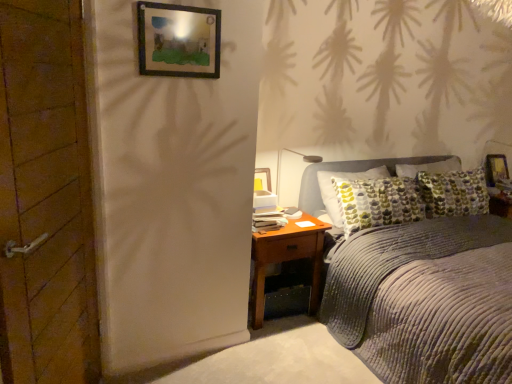
Question: Is wooden framed picture at upper center, which is counted as the second picture frame, starting from the back, bigger than wooden door at left?

Choices:
 (A) no
 (B) yes

Answer: (A)

Question: Is wooden framed picture at upper center, the 1th picture frame from the left, wider than wooden door at left?

Choices:
 (A) yes
 (B) no

Answer: (B)

Question: Can you confirm if wooden framed picture at upper center, which is the 2th picture frame in bottom-to-top order, is shorter than wooden door at left?

Choices:
 (A) no
 (B) yes

Answer: (B)

Question: Can you see wooden framed picture at upper center, the 1th picture frame from the left, touching wooden door at left?

Choices:
 (A) no
 (B) yes

Answer: (A)

Question: Is wooden framed picture at upper center, which is counted as the second picture frame, starting from the back, at the right side of wooden door at left?

Choices:
 (A) no
 (B) yes

Answer: (B)

Question: Considering the relative positions of wooden framed picture at upper center, arranged as the first picture frame when viewed from the top, and wooden door at left in the image provided, is wooden framed picture at upper center, arranged as the first picture frame when viewed from the top, in front of wooden door at left?

Choices:
 (A) no
 (B) yes

Answer: (A)

Question: Is the surface of wooden framed picture at upper center, which is the 2th picture frame in bottom-to-top order, in direct contact with brown wooden nightstand at lower right?

Choices:
 (A) no
 (B) yes

Answer: (A)

Question: Is wooden framed picture at upper center, the 1th picture frame from the left, facing away from brown wooden nightstand at lower right?

Choices:
 (A) no
 (B) yes

Answer: (A)

Question: Could you tell me if wooden framed picture at upper center, which ranks as the first picture frame in front-to-back order, is facing brown wooden nightstand at lower right?

Choices:
 (A) no
 (B) yes

Answer: (A)

Question: Can you confirm if wooden framed picture at upper center, arranged as the first picture frame when viewed from the top, is thinner than brown wooden nightstand at lower right?

Choices:
 (A) no
 (B) yes

Answer: (B)

Question: Can you confirm if wooden framed picture at upper center, positioned as the 2th picture frame in right-to-left order, is smaller than brown wooden nightstand at lower right?

Choices:
 (A) no
 (B) yes

Answer: (B)

Question: Does wooden framed picture at upper center, arranged as the first picture frame when viewed from the top, appear on the right side of brown wooden nightstand at lower right?

Choices:
 (A) yes
 (B) no

Answer: (B)

Question: Is corduroy gray bed at center far from wooden framed picture at upper center, arranged as the first picture frame when viewed from the top?

Choices:
 (A) no
 (B) yes

Answer: (B)